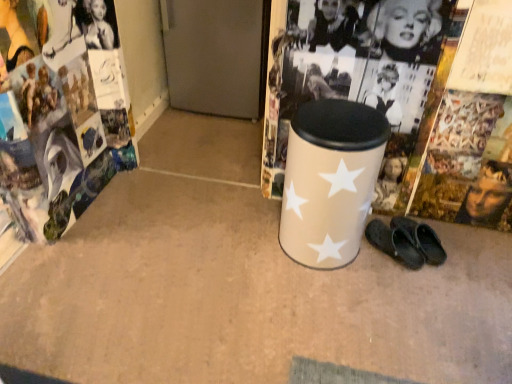
Question: Looking at their shapes, would you say beige matte waste container at center is wider or thinner than black rubber slippers at lower right?

Choices:
 (A) thin
 (B) wide

Answer: (B)

Question: Based on their sizes in the image, would you say beige matte waste container at center is bigger or smaller than black rubber slippers at lower right?

Choices:
 (A) big
 (B) small

Answer: (A)

Question: Based on their relative distances, which object is nearer to the matte paper magazine at left?

Choices:
 (A) beige matte waste container at center
 (B) black rubber slippers at lower right

Answer: (A)

Question: Estimate the real-world distances between objects in this image. Which object is farther from the matte paper magazine at left?

Choices:
 (A) beige matte waste container at center
 (B) black rubber slippers at lower right

Answer: (B)